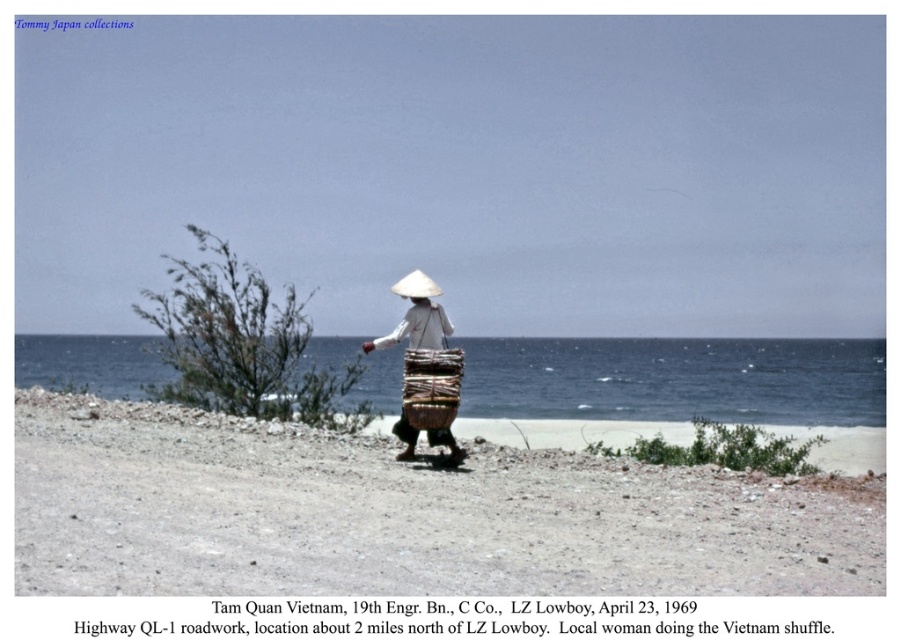
Question: Can you confirm if brown gravelly sand at center is smaller than white woven basket at center?

Choices:
 (A) yes
 (B) no

Answer: (B)

Question: Which of the following is the farthest from the observer?

Choices:
 (A) tap(56, 561)
 (B) tap(431, 353)
 (C) tap(387, 342)
 (D) tap(679, 413)

Answer: (D)

Question: Which is nearer to the white woven basket at center?

Choices:
 (A) blue water at center
 (B) brown woven basket at center
 (C) brown gravelly sand at center

Answer: (B)

Question: From the image, what is the correct spatial relationship of blue water at center in relation to white woven basket at center?

Choices:
 (A) right
 (B) left

Answer: (B)

Question: Does blue water at center have a larger size compared to brown woven basket at center?

Choices:
 (A) yes
 (B) no

Answer: (A)

Question: Which point is farther from the camera taking this photo?

Choices:
 (A) (883, 396)
 (B) (405, 330)
 (C) (442, 358)

Answer: (A)